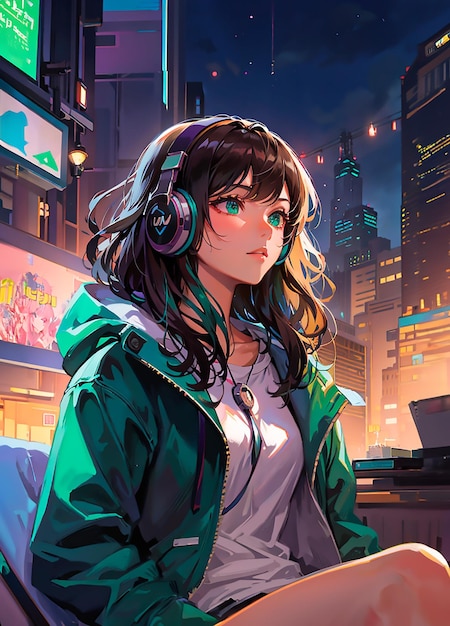
Find the location of `headphone ear piece`. headphone ear piece is located at coordinates (288, 248), (187, 225).